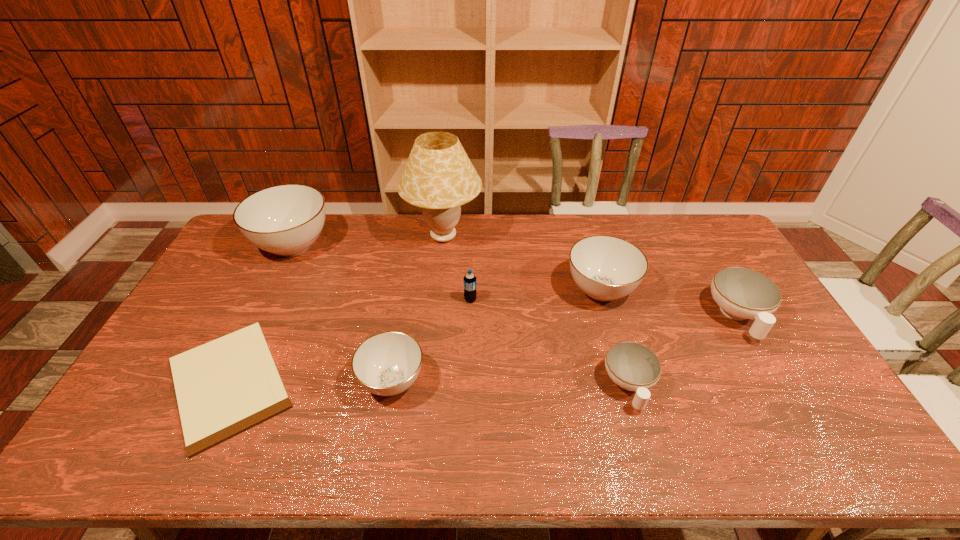
In order to click on the smallest gray chinaware in this screenshot , I will do `click(386, 364)`.

Find the location of a particular element. the left white chinaware is located at coordinates (632, 366).

The height and width of the screenshot is (540, 960). Find the location of `the shortest chinaware`. the shortest chinaware is located at coordinates (632, 366).

The height and width of the screenshot is (540, 960). What are the coordinates of `the shortest object` in the screenshot? It's located at (224, 387).

The width and height of the screenshot is (960, 540). I want to click on vacant space situated 0.370m on the front of the yellow lampshade, so click(433, 346).

Locate an element on the screen. Image resolution: width=960 pixels, height=540 pixels. free location located on the front of the second tallest object is located at coordinates (260, 313).

What are the coordinates of `free space located on the back of the rightmost gray chinaware` in the screenshot? It's located at (584, 230).

Identify the location of vacant space located 0.240m on the back of the soda bottle. (471, 248).

At what (x,y) coordinates should I click in order to perform the action: click on vacant region located on the side with the handle of the right white chinaware. Please return your answer as a coordinate pair (x, y). The height and width of the screenshot is (540, 960). Looking at the image, I should click on (817, 454).

Identify the location of vacant region located on the left of the fourth chinaware from right to left. The width and height of the screenshot is (960, 540). (323, 381).